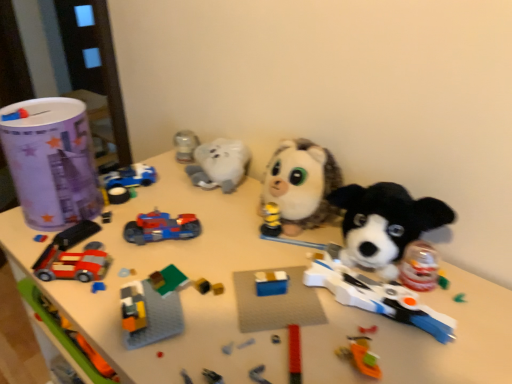
Locate an element on the screen. This screenshot has width=512, height=384. free location in front of blue plastic car at upper left, positioned as the third toy in right-to-left order is located at coordinates (113, 218).